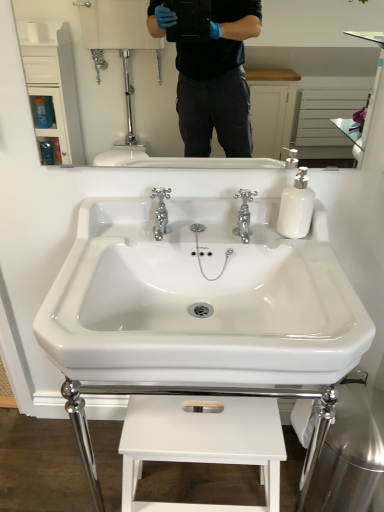
Question: Is white matte stool at lower center far away from white glossy sink at center?

Choices:
 (A) no
 (B) yes

Answer: (A)

Question: Is the depth of white matte stool at lower center greater than that of white glossy sink at center?

Choices:
 (A) no
 (B) yes

Answer: (B)

Question: Is white matte stool at lower center not inside white glossy sink at center?

Choices:
 (A) yes
 (B) no

Answer: (A)

Question: Does white matte stool at lower center contain white glossy sink at center?

Choices:
 (A) yes
 (B) no

Answer: (B)

Question: Considering the relative sizes of white matte stool at lower center and white glossy sink at center in the image provided, is white matte stool at lower center taller than white glossy sink at center?

Choices:
 (A) no
 (B) yes

Answer: (B)

Question: Is white matte stool at lower center touching white glossy sink at center?

Choices:
 (A) yes
 (B) no

Answer: (B)

Question: Can you confirm if white glossy soap dispenser at right is positioned to the right of white glossy mirror at upper center?

Choices:
 (A) no
 (B) yes

Answer: (B)

Question: From the image's perspective, is white glossy soap dispenser at right on top of white glossy mirror at upper center?

Choices:
 (A) no
 (B) yes

Answer: (A)

Question: From the image's perspective, does white glossy soap dispenser at right appear lower than white glossy mirror at upper center?

Choices:
 (A) yes
 (B) no

Answer: (A)

Question: From a real-world perspective, is white glossy soap dispenser at right under white glossy mirror at upper center?

Choices:
 (A) yes
 (B) no

Answer: (A)

Question: Is the depth of white glossy soap dispenser at right greater than that of white glossy mirror at upper center?

Choices:
 (A) no
 (B) yes

Answer: (B)

Question: Considering the relative sizes of white glossy soap dispenser at right and white glossy mirror at upper center in the image provided, is white glossy soap dispenser at right bigger than white glossy mirror at upper center?

Choices:
 (A) no
 (B) yes

Answer: (A)

Question: Is chrome metallic faucet at center, acting as the 1th tap starting from the right, at the right side of white glossy mirror at upper center?

Choices:
 (A) yes
 (B) no

Answer: (A)